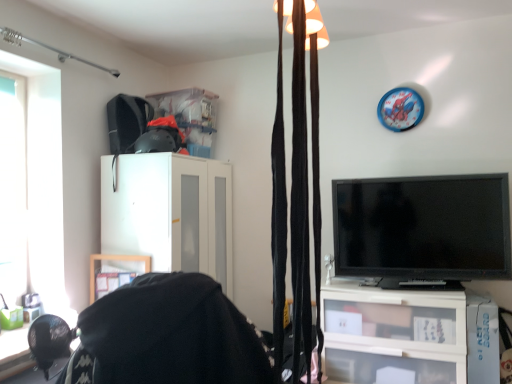
Question: From the image's perspective, is transparent glass window at left on top of blue plastic clock at upper right?

Choices:
 (A) no
 (B) yes

Answer: (A)

Question: Considering the relative sizes of transparent glass window at left and blue plastic clock at upper right in the image provided, is transparent glass window at left thinner than blue plastic clock at upper right?

Choices:
 (A) no
 (B) yes

Answer: (A)

Question: Is transparent glass window at left outside blue plastic clock at upper right?

Choices:
 (A) yes
 (B) no

Answer: (A)

Question: Is there a large distance between transparent glass window at left and blue plastic clock at upper right?

Choices:
 (A) yes
 (B) no

Answer: (A)

Question: Is the position of transparent glass window at left more distant than that of blue plastic clock at upper right?

Choices:
 (A) no
 (B) yes

Answer: (A)

Question: Does transparent glass window at left have a lesser height compared to blue plastic clock at upper right?

Choices:
 (A) yes
 (B) no

Answer: (B)

Question: Is black glossy tv at right looking in the opposite direction of blue plastic clock at upper right?

Choices:
 (A) no
 (B) yes

Answer: (A)

Question: Is black glossy tv at right not near blue plastic clock at upper right?

Choices:
 (A) no
 (B) yes

Answer: (A)

Question: Is black glossy tv at right facing towards blue plastic clock at upper right?

Choices:
 (A) yes
 (B) no

Answer: (B)

Question: Is black glossy tv at right positioned in front of blue plastic clock at upper right?

Choices:
 (A) yes
 (B) no

Answer: (A)

Question: Could blue plastic clock at upper right be considered to be inside black glossy tv at right?

Choices:
 (A) yes
 (B) no

Answer: (B)

Question: From a real-world perspective, is black glossy tv at right under blue plastic clock at upper right?

Choices:
 (A) yes
 (B) no

Answer: (A)

Question: Can you confirm if transparent glass window at left is taller than black velvet curtains at upper center?

Choices:
 (A) yes
 (B) no

Answer: (A)